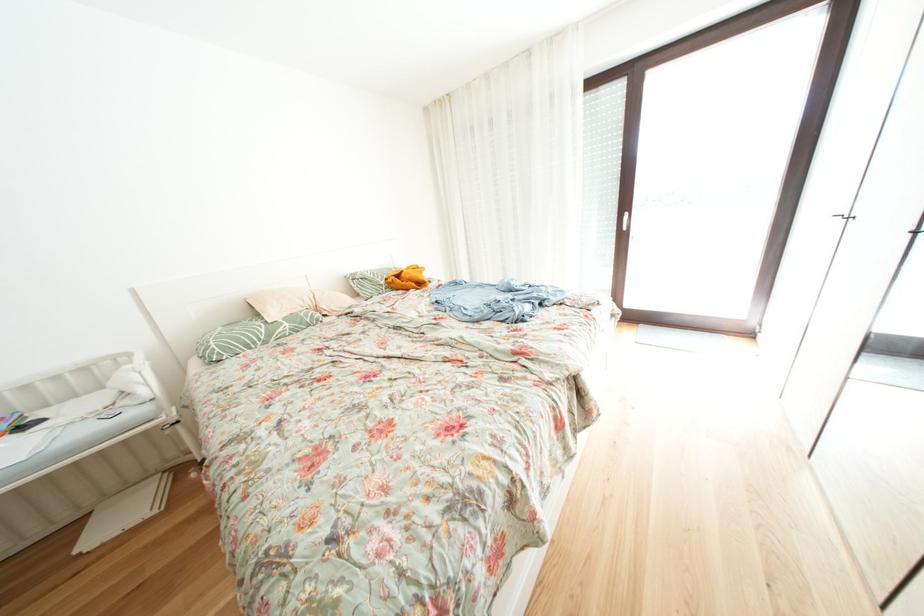
The image size is (924, 616). What are the coordinates of `white door handle` in the screenshot? It's located at (624, 220).